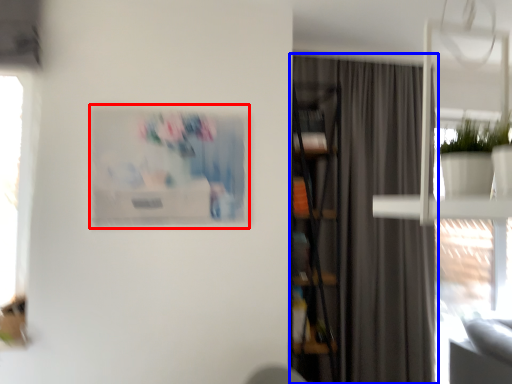
Question: Which object is further to the camera taking this photo, picture frame (highlighted by a red box) or curtain (highlighted by a blue box)?

Choices:
 (A) picture frame
 (B) curtain

Answer: (B)